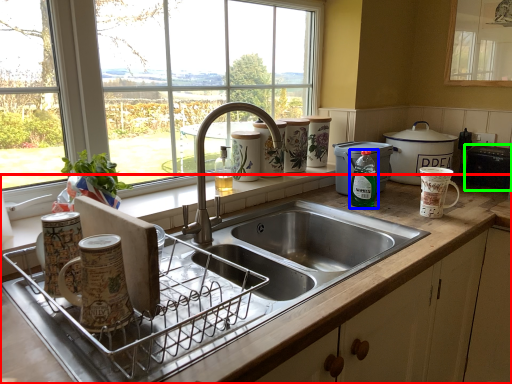
Question: Based on their relative distances, which object is farther from countertop (highlighted by a red box)? Choose from bottle (highlighted by a blue box) and appliance (highlighted by a green box).

Choices:
 (A) bottle
 (B) appliance

Answer: (B)